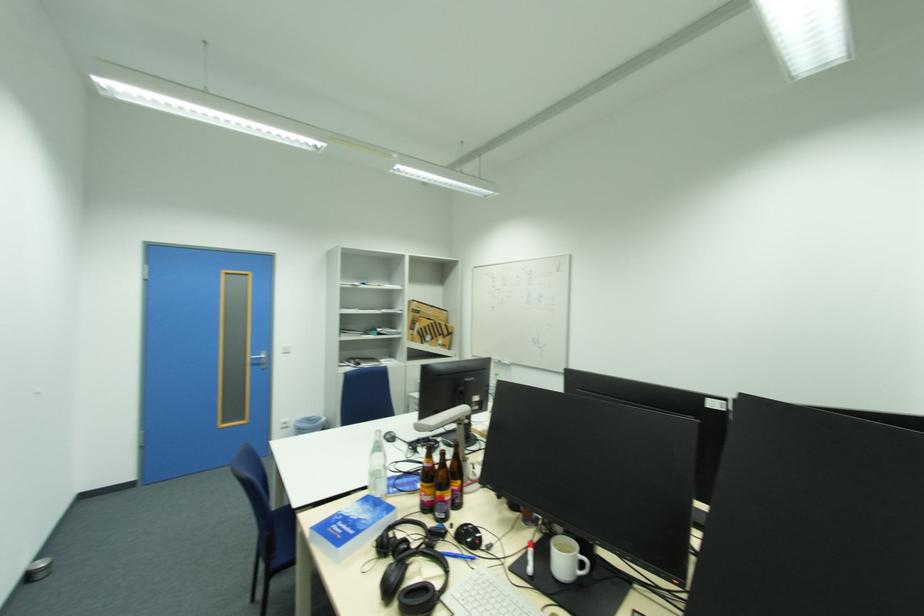
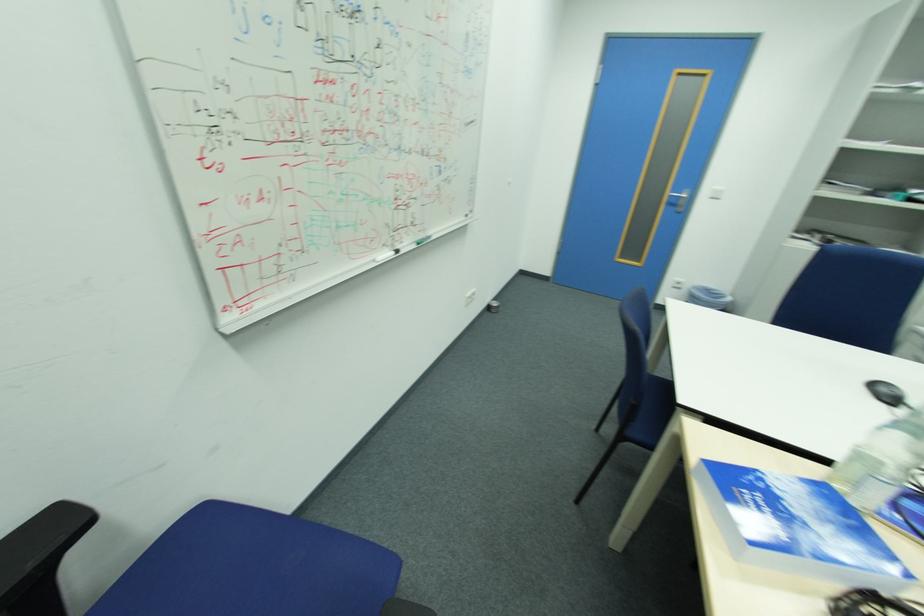
First-person continuous shooting, in which direction is the camera rotating?

The camera's rotation is toward left-down.